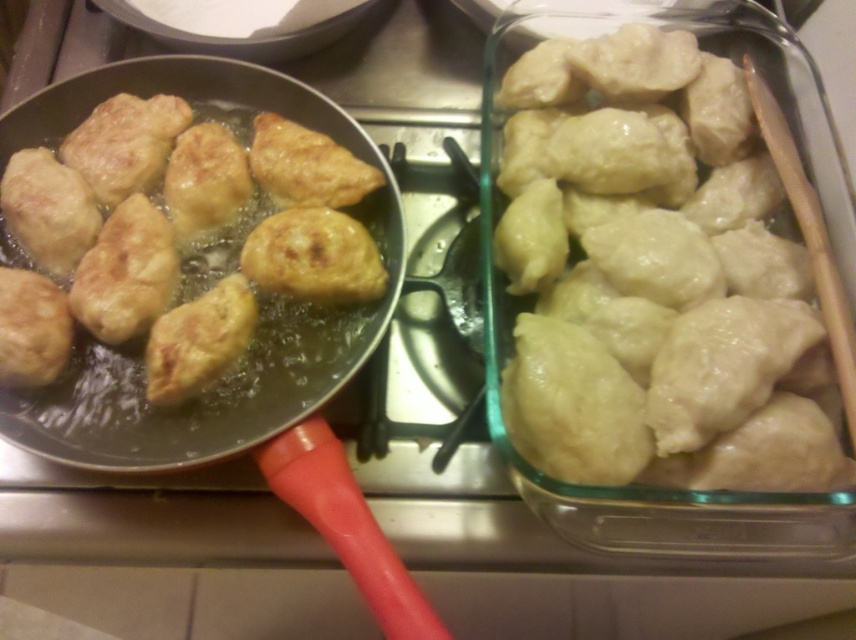
Can you confirm if golden brown dough at center is thinner than shiny metal pan at center?

Yes.

Can you confirm if golden brown dough at center is wider than shiny metal pan at center?

No.

Does point (254, 316) come in front of point (146, 472)?

No, (254, 316) is further to viewer.

Locate an element on the screen. The width and height of the screenshot is (856, 640). golden brown dough at center is located at coordinates (174, 237).

Which of these two, glossy white dumplings at right or shiny metal pan at center, stands shorter?

glossy white dumplings at right

This screenshot has width=856, height=640. Identify the location of glossy white dumplings at right. (649, 273).

Between glossy white dumplings at right and golden brown dough at center, which one is positioned lower?

glossy white dumplings at right is lower down.

Does glossy white dumplings at right appear under golden brown dough at center?

Correct, glossy white dumplings at right is located below golden brown dough at center.

Between point (730, 276) and point (48, 220), which one is positioned in front?

Point (48, 220) is more forward.

The height and width of the screenshot is (640, 856). I want to click on glossy white dumplings at right, so click(x=649, y=273).